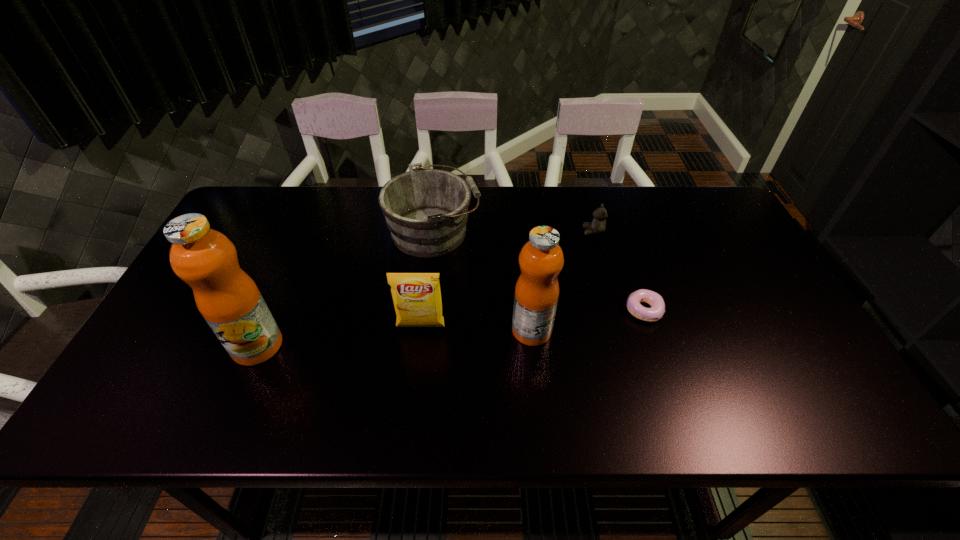
You are a GUI agent. You are given a task and a screenshot of the screen. Output one action in this format:
    pyautogui.click(x=<x>, y=<y>)
    Task: Click on the free point that keeps the fruit juices evenly spaced on the right
    The height and width of the screenshot is (540, 960).
    Given the screenshot: What is the action you would take?
    pyautogui.click(x=791, y=316)